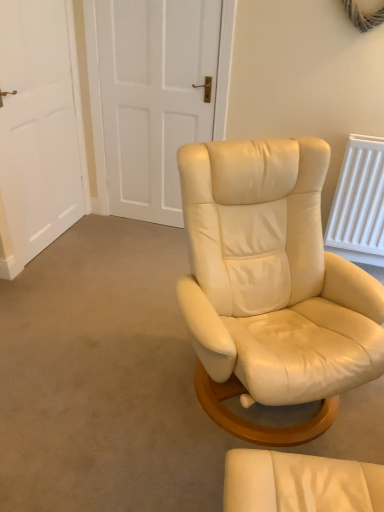
Find the location of a particular element. vacant area that lies in front of white matte door at upper left, which is counted as the 1th door, starting from the left is located at coordinates (60, 275).